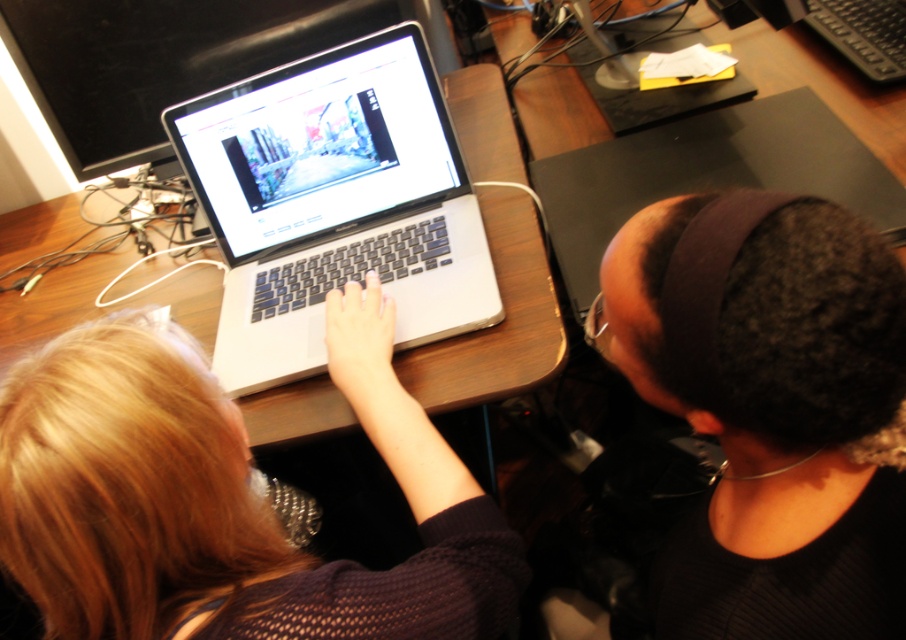
Who is more forward, (0, 216) or (903, 225)?

Point (903, 225)

Between wooden table at center and sleek silver laptop at center, which one is positioned lower?

sleek silver laptop at center is lower down.

This screenshot has height=640, width=906. Find the location of `wooden table at center`. wooden table at center is located at coordinates (496, 324).

Identify the location of wooden table at center. (496, 324).

Which is more to the left, silver/black laptop at center or sleek silver laptop at center?

silver/black laptop at center

Can you confirm if silver/black laptop at center is positioned above sleek silver laptop at center?

Incorrect, silver/black laptop at center is not positioned above sleek silver laptop at center.

Describe the element at coordinates (334, 204) in the screenshot. I see `silver/black laptop at center` at that location.

I want to click on silver/black laptop at center, so click(334, 204).

Does blonde hair at center lie behind sleek silver laptop at center?

No, it is not.

Does blonde hair at center appear on the left side of sleek silver laptop at center?

Yes, blonde hair at center is to the left of sleek silver laptop at center.

Who is more forward, (172, 387) or (589, 301)?

Point (172, 387) is more forward.

Locate an element on the screen. Image resolution: width=906 pixels, height=640 pixels. blonde hair at center is located at coordinates (225, 499).